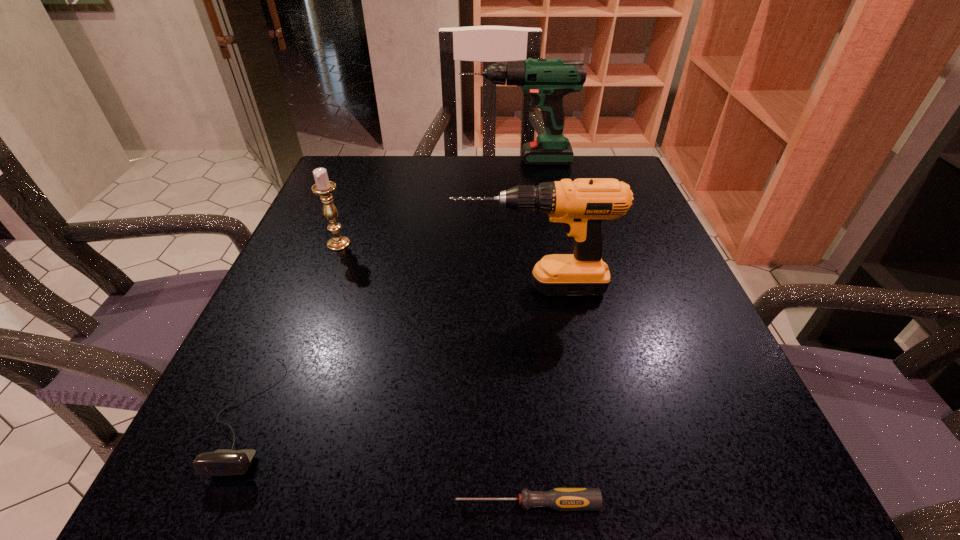
At what (x,y) coordinates should I click in order to perform the action: click on screwdriver located at the near edge. Please return your answer as a coordinate pair (x, y). Looking at the image, I should click on (562, 499).

At what (x,y) coordinates should I click in order to perform the action: click on candle holder positioned at the left edge. Please return your answer as a coordinate pair (x, y). The height and width of the screenshot is (540, 960). Looking at the image, I should click on pos(323,187).

Locate an element on the screen. This screenshot has height=540, width=960. webcam that is at the left edge is located at coordinates (224, 462).

In order to click on object located at the near left corner in this screenshot , I will do `click(224, 462)`.

This screenshot has width=960, height=540. Find the location of `object that is positioned at the far right corner`. object that is positioned at the far right corner is located at coordinates (547, 80).

You are a GUI agent. You are given a task and a screenshot of the screen. Output one action in this format:
    pyautogui.click(x=<x>, y=<y>)
    Task: Click on the free space at the far edge of the desktop
    The width and height of the screenshot is (960, 540).
    Given the screenshot: What is the action you would take?
    pos(558,166)

This screenshot has width=960, height=540. I want to click on free space at the near edge of the desktop, so click(474, 478).

Where is `vacant space at the left edge`? The width and height of the screenshot is (960, 540). vacant space at the left edge is located at coordinates tap(360, 213).

Locate an element on the screen. vacant region at the right edge of the desktop is located at coordinates (608, 236).

At what (x,y) coordinates should I click in order to perform the action: click on free space at the far left corner of the desktop. Please return your answer as a coordinate pair (x, y). The height and width of the screenshot is (540, 960). Looking at the image, I should click on (343, 197).